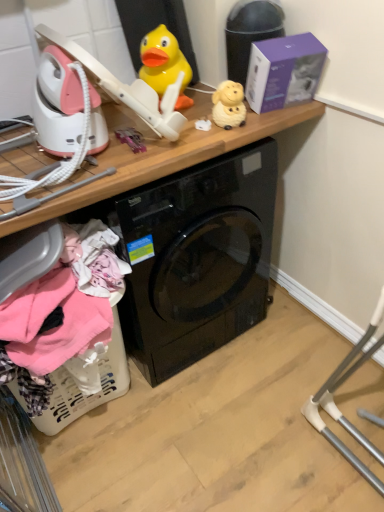
The image size is (384, 512). What are the coordinates of `vacant space positioned to the left of matte yellow sheep at upper center, positioned as the first toy in right-to-left order` in the screenshot? It's located at click(x=194, y=139).